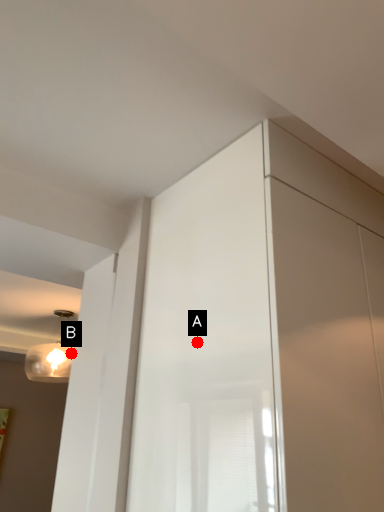
Question: Two points are circled on the image, labeled by A and B beside each circle. Which point is closer to the camera?

Choices:
 (A) A is closer
 (B) B is closer

Answer: (A)